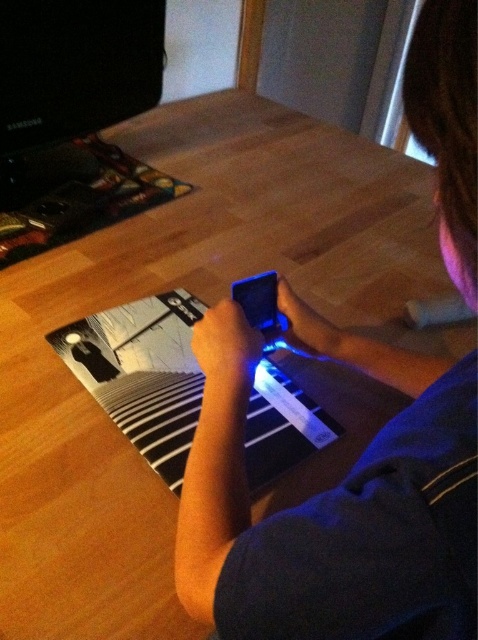
You are a delivery robot with a package that is 6 inches long. You need to place it on the table between the blue matte phone at center and the black glossy magazine at center. Can you fit the package between them without moving either object?

The blue matte phone at center is 5.29 inches away from the black glossy magazine at center. Since the package is 6 inches long, which is slightly longer than the distance between them, you cannot fit the package between them without moving either object.

You are a delivery person who needs to place a package on the table. The package is the size of the black glossy magazine at center. Is there enough space between the blue matte phone at center and the edge of the table to place the package?

The blue matte phone at center is larger than the black glossy magazine at center. Since the package is the size of the magazine, there should be enough space between the phone and the table edge to place it.